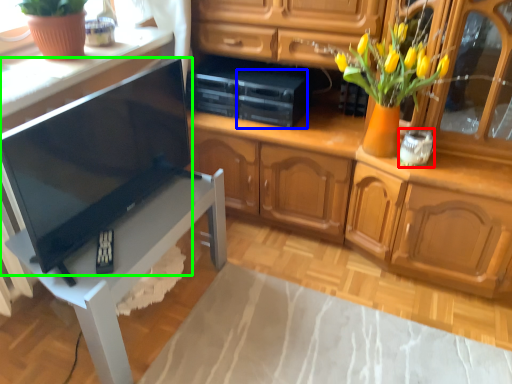
Question: Which is nearer to the appliance (highlighted by a red box)? appliance (highlighted by a blue box) or television (highlighted by a green box).

Choices:
 (A) appliance
 (B) television

Answer: (A)